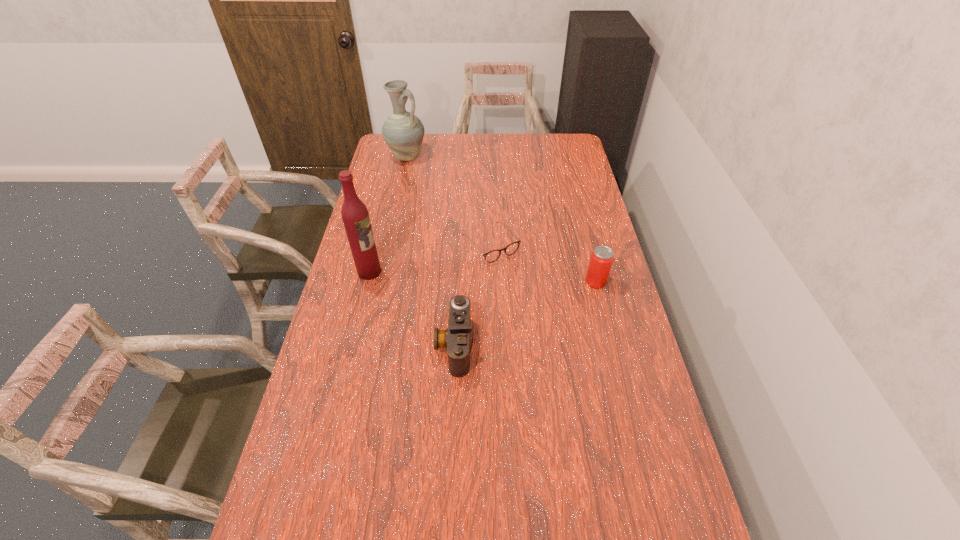
Image resolution: width=960 pixels, height=540 pixels. Find the location of `vacant area at the near right corner of the desktop`. vacant area at the near right corner of the desktop is located at coordinates (646, 534).

Where is `unoccupied area between the farthest object and the spectacles`? Image resolution: width=960 pixels, height=540 pixels. unoccupied area between the farthest object and the spectacles is located at coordinates (448, 201).

Locate an element on the screen. Image resolution: width=960 pixels, height=540 pixels. vacant point located between the can and the shortest object is located at coordinates (543, 263).

Image resolution: width=960 pixels, height=540 pixels. What are the coordinates of `empty location between the camera and the pitcher` in the screenshot? It's located at (430, 251).

The image size is (960, 540). What are the coordinates of `unoccupied position between the spectacles and the can` in the screenshot? It's located at (543, 263).

Identify the location of free spot between the pitcher and the nearest object. (430, 251).

What are the coordinates of `free space between the nearest object and the liquor` in the screenshot? It's located at (412, 308).

I want to click on vacant region between the fourth tallest object and the third shortest object, so click(525, 313).

You are a GUI agent. You are given a task and a screenshot of the screen. Output one action in this format:
    pyautogui.click(x=<x>, y=<y>)
    Task: Click on the free space between the liquor and the spectacles
    The image size is (960, 540).
    Given the screenshot: What is the action you would take?
    pyautogui.click(x=430, y=258)

Image resolution: width=960 pixels, height=540 pixels. Find the location of `empty location between the liquor and the shortest object`. empty location between the liquor and the shortest object is located at coordinates (430, 258).